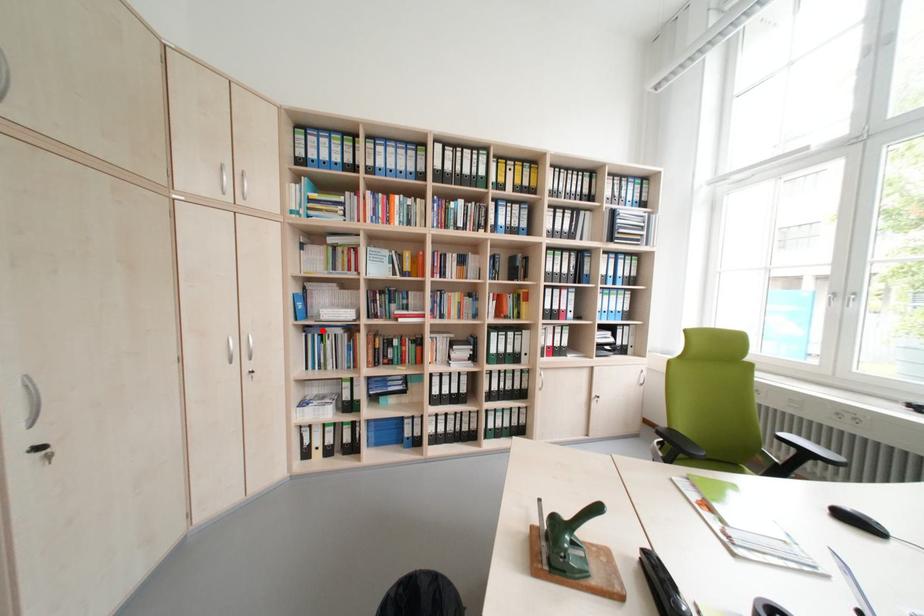
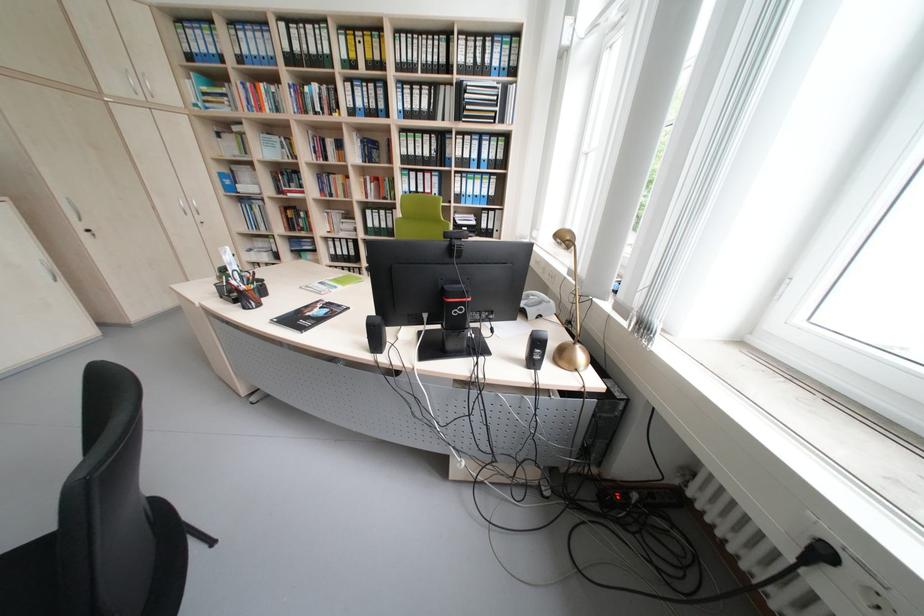
In the second image, find the point that corresponds to the highlighted location in the first image.

(253, 201)